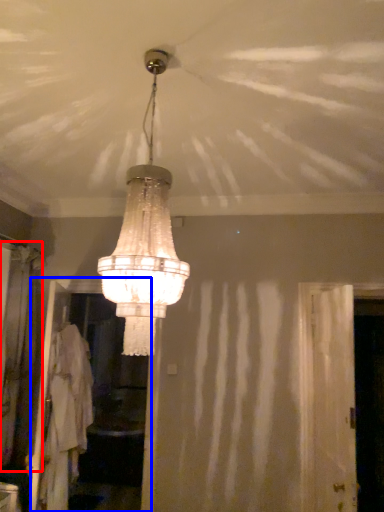
Question: Which object appears closest to the camera in this image, curtain (highlighted by a red box) or screen door (highlighted by a blue box)?

Choices:
 (A) curtain
 (B) screen door

Answer: (A)